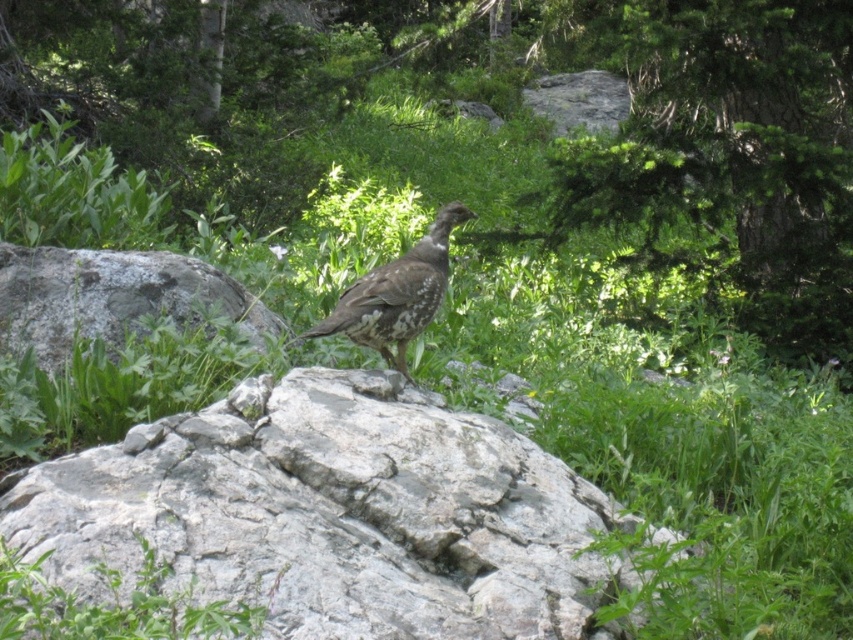
You are a hiker trying to locate the gray rock at center and the gray rough boulder at center in the forest. According to the image, which one is positioned to the right of the other?

The gray rock at center is positioned to the right of the gray rough boulder at center.

You are a hiker who wants to place a 1.5 meter long backpack between the gray rock at center and the gray rough boulder at center. Can you fit it there?

The distance between the gray rock at center and the gray rough boulder at center is 1.80 meters, so yes, the backpack can fit between them since it is shorter than the available space.